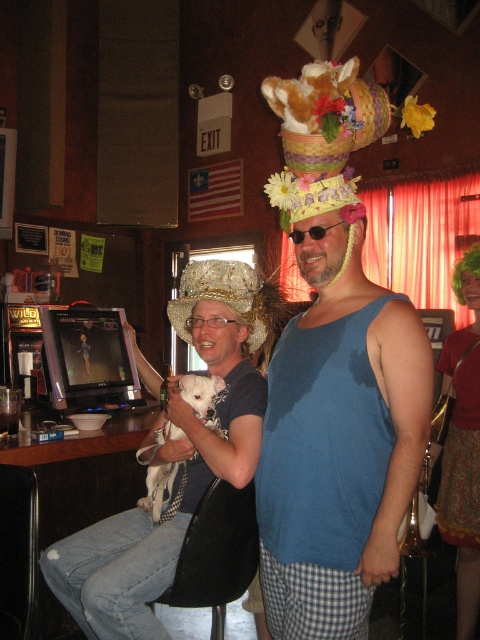
Question: Is sparkly gold headdress at center to the right of green fabric hat at center from the viewer's perspective?

Choices:
 (A) yes
 (B) no

Answer: (B)

Question: Which object is the closest to the fuzzy white dog at center?

Choices:
 (A) white fur dog at center
 (B) green fabric dress at lower right

Answer: (A)

Question: Which object is the farthest from the sparkly gold headdress at center?

Choices:
 (A) white fur dog at center
 (B) green fabric hat at center
 (C) fuzzy white dog at center
 (D) green fabric dress at lower right

Answer: (B)

Question: Which object is the closest to the green fabric hat at center?

Choices:
 (A) blue fabric tank top at center
 (B) green fabric dress at lower right
 (C) fuzzy white dog at center

Answer: (B)

Question: Can you confirm if green fabric dress at lower right is wider than white fur dog at center?

Choices:
 (A) no
 (B) yes

Answer: (A)

Question: Does blue fabric tank top at center appear on the right side of white fur dog at center?

Choices:
 (A) no
 (B) yes

Answer: (B)